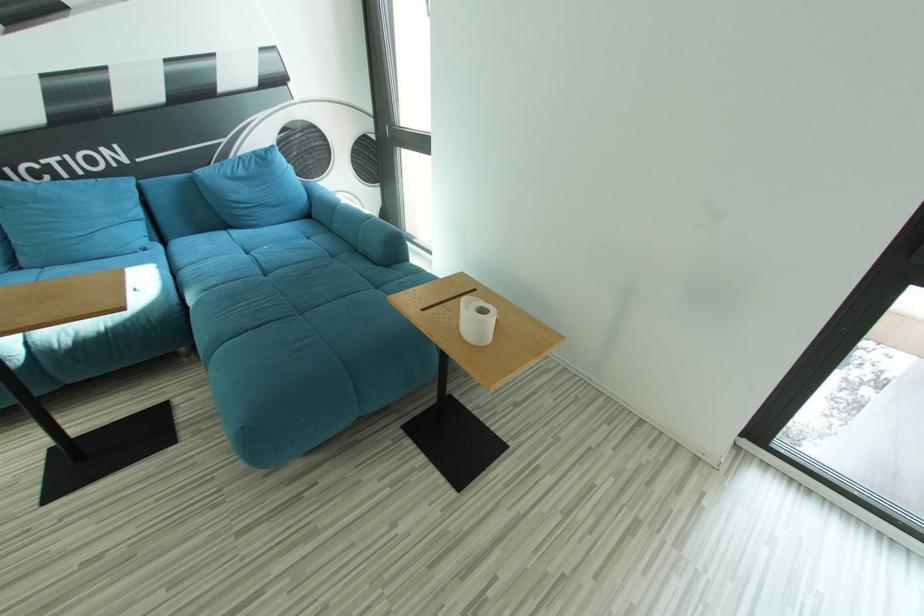
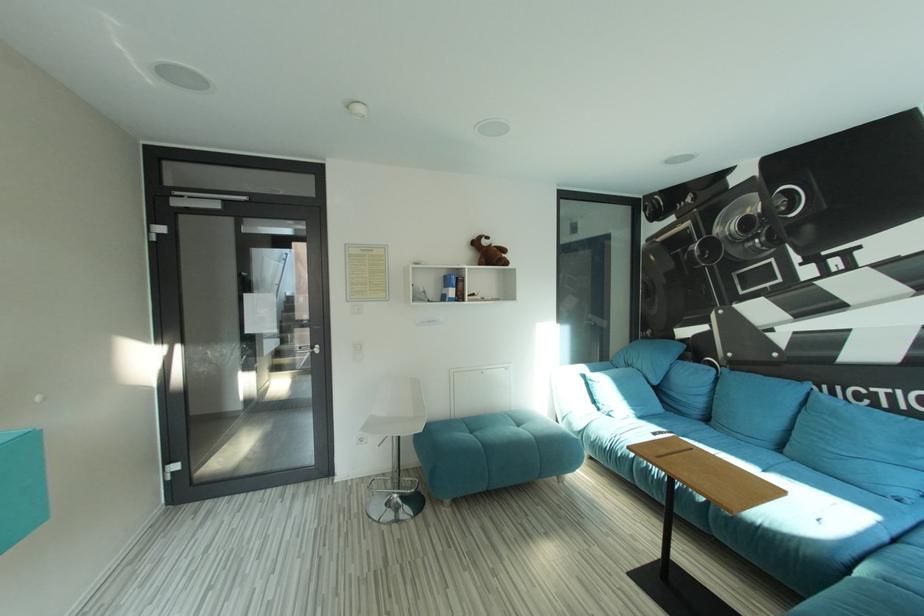
Question: How did the camera likely rotate?

Choices:
 (A) Left
 (B) Right
 (C) Up
 (D) Down

Answer: (A)